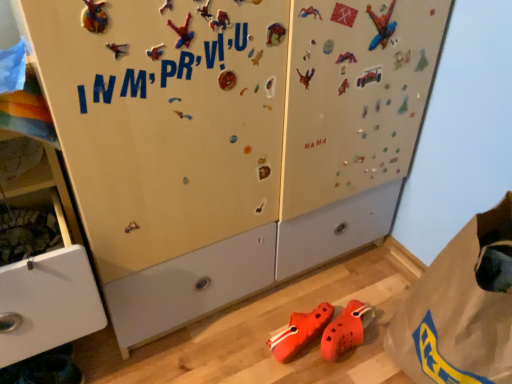
Question: From the image's perspective, is matte white cabinet at left over orange rubber clogs at lower center?

Choices:
 (A) no
 (B) yes

Answer: (B)

Question: Does matte white cabinet at left appear on the left side of orange rubber clogs at lower center?

Choices:
 (A) no
 (B) yes

Answer: (B)

Question: Is matte white cabinet at left far from orange rubber clogs at lower center?

Choices:
 (A) no
 (B) yes

Answer: (A)

Question: Considering the relative positions of matte white cabinet at left and orange rubber clogs at lower center in the image provided, is matte white cabinet at left in front of orange rubber clogs at lower center?

Choices:
 (A) no
 (B) yes

Answer: (B)

Question: From the image's perspective, is matte white cabinet at left beneath orange rubber clogs at lower center?

Choices:
 (A) yes
 (B) no

Answer: (B)

Question: Does matte white cabinet at left come behind orange rubber clogs at lower center?

Choices:
 (A) no
 (B) yes

Answer: (A)

Question: Does matte white cabinet at left appear on the right side of brown paper bag at lower right?

Choices:
 (A) yes
 (B) no

Answer: (B)

Question: Is brown paper bag at lower right inside matte white cabinet at left?

Choices:
 (A) no
 (B) yes

Answer: (A)

Question: From a real-world perspective, is matte white cabinet at left below brown paper bag at lower right?

Choices:
 (A) no
 (B) yes

Answer: (A)

Question: Considering the relative sizes of matte white cabinet at left and brown paper bag at lower right in the image provided, is matte white cabinet at left shorter than brown paper bag at lower right?

Choices:
 (A) yes
 (B) no

Answer: (B)

Question: From a real-world perspective, is matte white cabinet at left on top of brown paper bag at lower right?

Choices:
 (A) yes
 (B) no

Answer: (A)

Question: Is matte white cabinet at left wider than brown paper bag at lower right?

Choices:
 (A) no
 (B) yes

Answer: (A)

Question: Does brown paper bag at lower right have a lesser height compared to matte white cabinet at left?

Choices:
 (A) no
 (B) yes

Answer: (B)